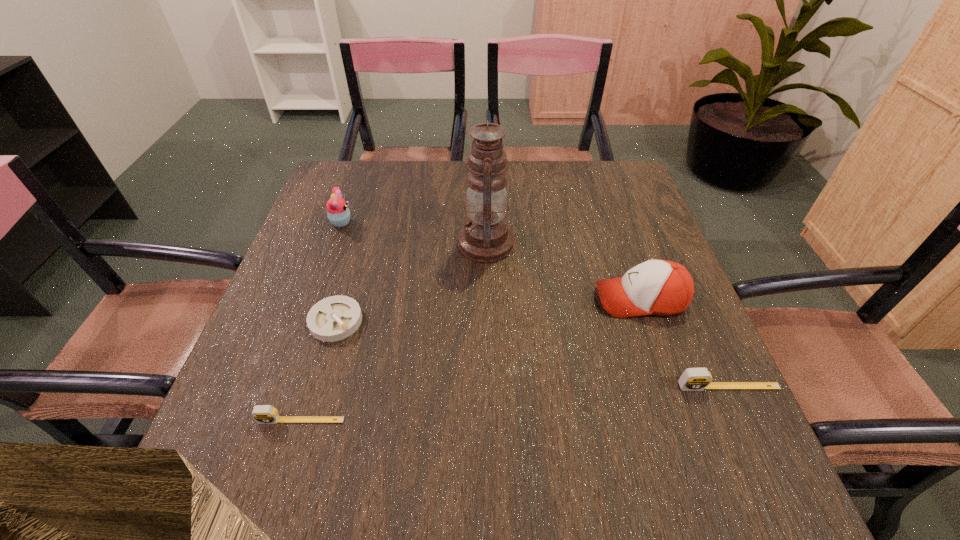
Where is `the nearest object`? the nearest object is located at coordinates (263, 414).

The height and width of the screenshot is (540, 960). I want to click on the left tape measure, so click(263, 414).

Find the location of a particular element. the farther tape measure is located at coordinates (693, 379).

The image size is (960, 540). Find the location of `the third shortest object`. the third shortest object is located at coordinates (693, 379).

Locate an element on the screen. The height and width of the screenshot is (540, 960). oil lamp is located at coordinates (486, 238).

Locate an element on the screen. This screenshot has height=540, width=960. the fourth object from left to right is located at coordinates (486, 238).

Where is `the shortest object`? This screenshot has height=540, width=960. the shortest object is located at coordinates (334, 318).

The width and height of the screenshot is (960, 540). I want to click on cupcake, so click(338, 213).

Locate an element on the screen. baseball cap is located at coordinates (x=659, y=287).

Locate an element on the screen. The image size is (960, 540). free space located at the front of the third shortest object with the tape extended is located at coordinates (747, 427).